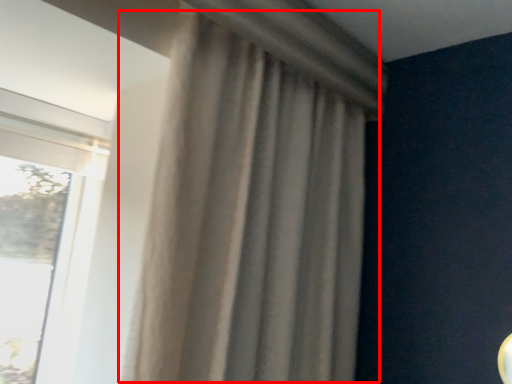
Question: From the image, what is the correct spatial relationship of curtain (annotated by the red box) in relation to window?

Choices:
 (A) left
 (B) right

Answer: (B)